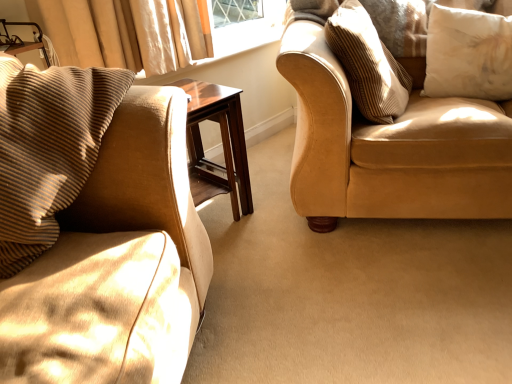
Find the location of `vacant region to the right of mahogany wood side table at center`. vacant region to the right of mahogany wood side table at center is located at coordinates (269, 206).